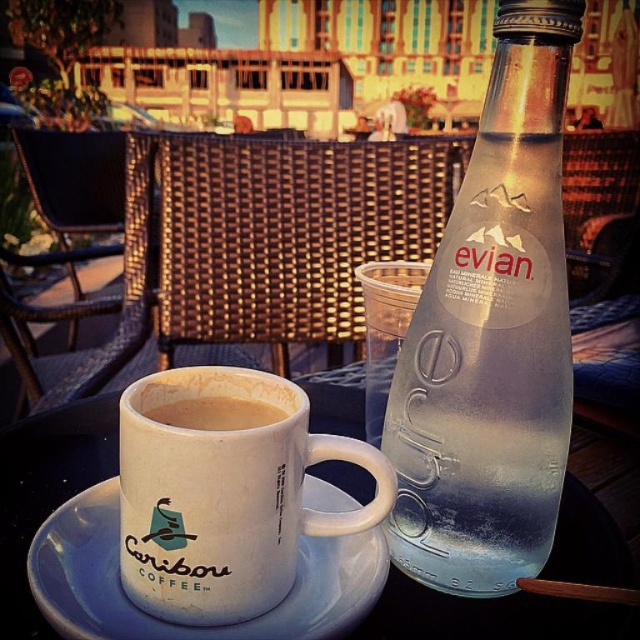
Where is `white matte mug at center`? white matte mug at center is located at coordinates (225, 492).

Who is more distant from viewer, (x=170, y=467) or (x=595, y=528)?

The point (x=595, y=528) is behind.

Identify the location of white matte mug at center. (225, 492).

Which is above, clear glass bottle at upper right or white ceramic cup at center?

clear glass bottle at upper right

Is clear glass bottle at upper right below white ceramic cup at center?

Incorrect, clear glass bottle at upper right is not positioned below white ceramic cup at center.

Is point (545, 364) in front of point (16, 435)?

Yes, point (545, 364) is closer to viewer.

You are a GUI agent. You are given a task and a screenshot of the screen. Output one action in this format:
    pyautogui.click(x=<x>, y=<y>)
    Task: Click on the clear glass bottle at upper right
    The width and height of the screenshot is (640, 640).
    Given the screenshot: What is the action you would take?
    pyautogui.click(x=492, y=337)

This screenshot has height=640, width=640. Describe the element at coordinates (225, 492) in the screenshot. I see `white matte mug at center` at that location.

Does white matte mug at center have a lesser height compared to brown matte coffee cup at center?

In fact, white matte mug at center may be taller than brown matte coffee cup at center.

Where is `white matte mug at center`? The height and width of the screenshot is (640, 640). white matte mug at center is located at coordinates (225, 492).

Where is `white matte mug at center`? The width and height of the screenshot is (640, 640). white matte mug at center is located at coordinates [225, 492].